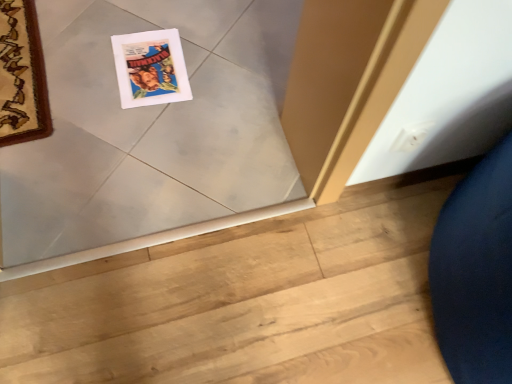
Where is `blank space situated above wooden floor at lower left (from a real-world perspective)`? This screenshot has width=512, height=384. blank space situated above wooden floor at lower left (from a real-world perspective) is located at coordinates (272, 298).